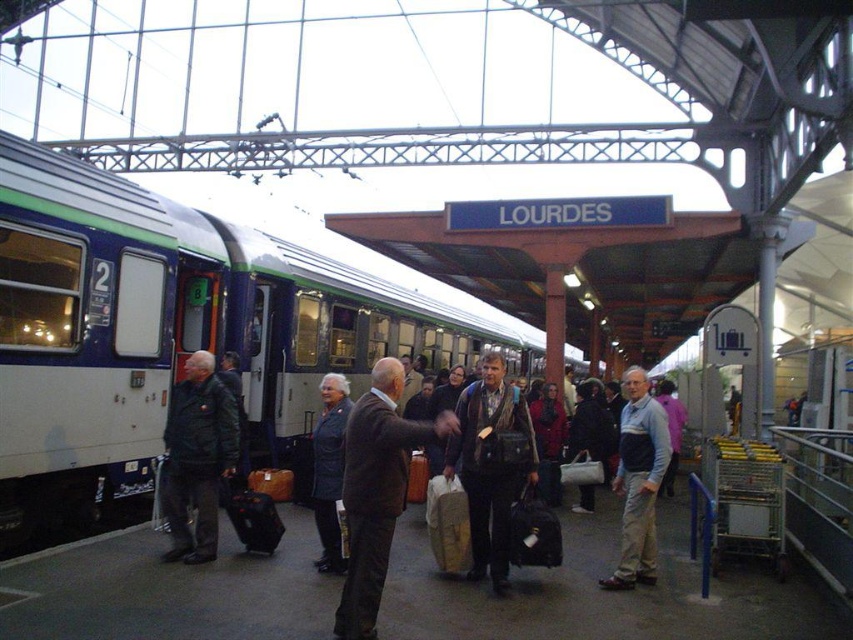
You are standing on the platform and see both the white glossy train at center and the brown leather jacket at center. Which object is closer to you?

The white glossy train at center is closer to you than the brown leather jacket at center.

You are a photographer standing on the Lourdes platform. You want to capture both the white glossy train at center and the light brown leather jacket at center in a single photo. Which object should you focus on first to ensure both are in frame?

The white glossy train at center is larger in size than the light brown leather jacket at center, so you should focus on the white glossy train at center first to ensure both are in frame.

You are standing on the Lourdes train platform and want to board the train. Where should you go to find the white glossy train at center?

The white glossy train at center is located at point (170, 330) on the platform.